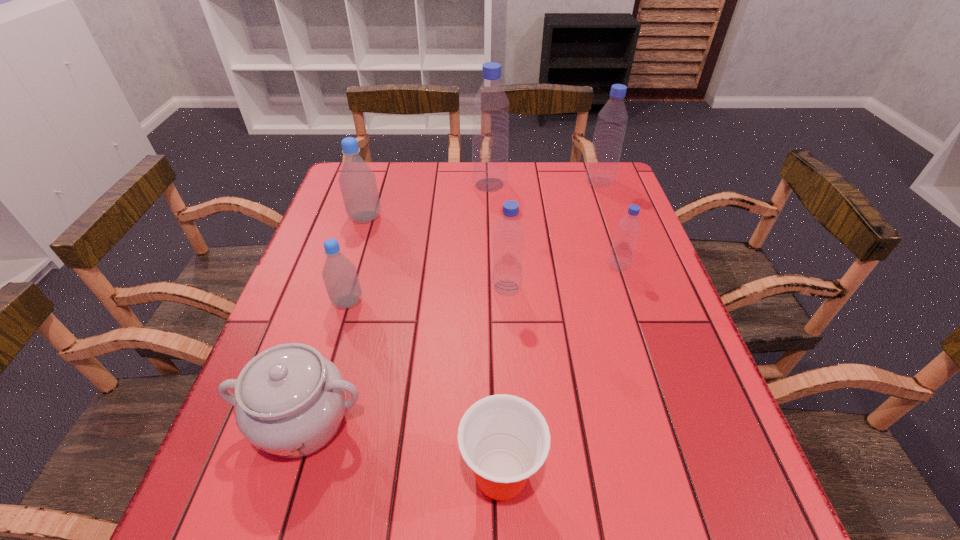
This screenshot has width=960, height=540. Identify the location of vacant space located on the left of the red cup. (287, 476).

Image resolution: width=960 pixels, height=540 pixels. I want to click on object that is at the near edge, so click(x=504, y=439).

What are the coordinates of `chinaware at the left edge` in the screenshot? It's located at (289, 400).

Where is `object at the far right corner`? object at the far right corner is located at coordinates (602, 167).

You are a GUI agent. You are given a task and a screenshot of the screen. Output one action in this format:
    pyautogui.click(x=<x>, y=<y>)
    Task: Click on the free point at the far edge
    
    Given the screenshot: What is the action you would take?
    pyautogui.click(x=526, y=168)

You are a GUI agent. You are given a task and a screenshot of the screen. Output one action in this format:
    pyautogui.click(x=<x>, y=<y>)
    Task: Click on the vacant region at the left edge
    
    Given the screenshot: What is the action you would take?
    pyautogui.click(x=356, y=253)

This screenshot has height=540, width=960. Identify the location of vacant space at the right edge. (698, 458).

Locate an element on the screen. This screenshot has width=960, height=540. vacant area at the near left corner is located at coordinates (222, 525).

Where is `free space at the far right corner of the desktop`? The image size is (960, 540). free space at the far right corner of the desktop is located at coordinates (602, 192).

Locate an element on the screen. The image size is (960, 540). unoccupied area between the smaller gray bottle and the third farthest bottle is located at coordinates (356, 259).